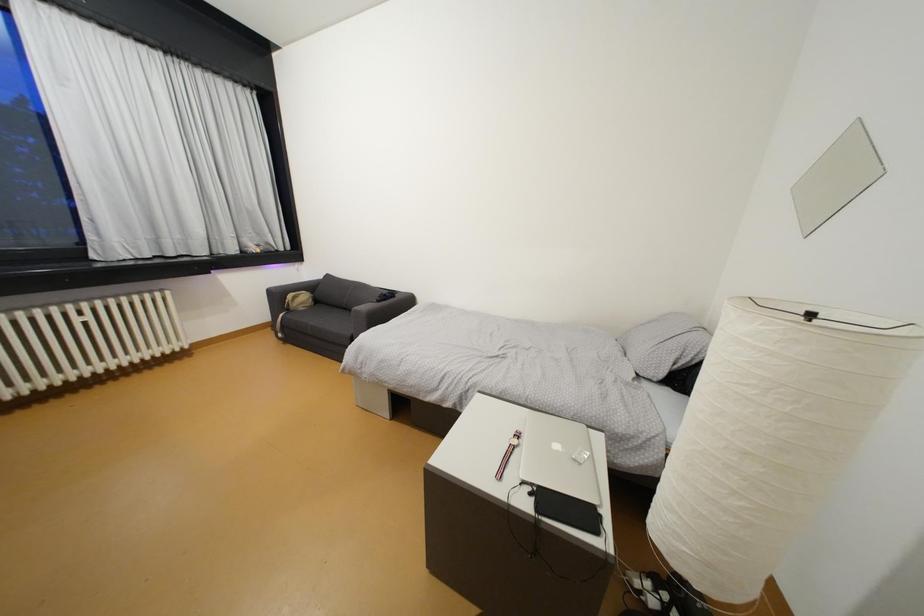
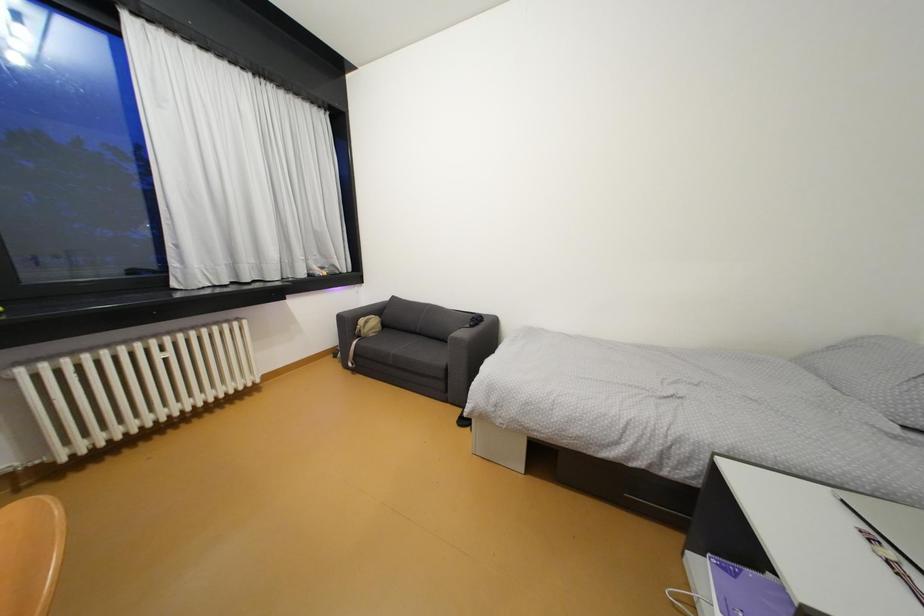
Question: The first image is from the beginning of the video and the second image is from the end. How did the camera likely rotate when shooting the video?

Choices:
 (A) Left
 (B) Right
 (C) Up
 (D) Down

Answer: (C)